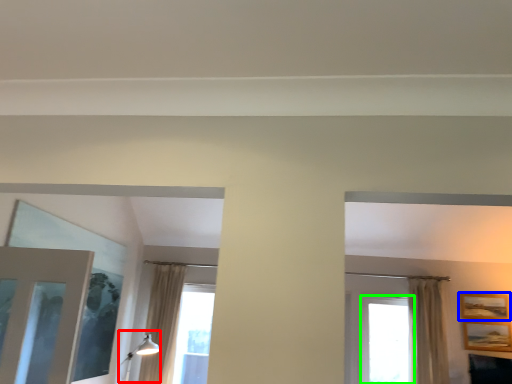
Question: Estimate the real-world distances between objects in this image. Which object is farther from light fixture (highlighted by a red box), picture frame (highlighted by a blue box) or window (highlighted by a green box)?

Choices:
 (A) picture frame
 (B) window

Answer: (A)